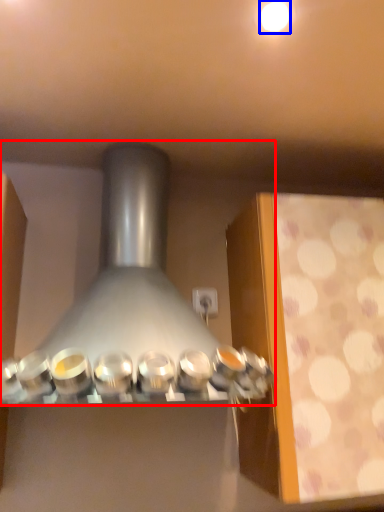
Question: Which object is further to the camera taking this photo, kitchen appliance (highlighted by a red box) or lighting (highlighted by a blue box)?

Choices:
 (A) kitchen appliance
 (B) lighting

Answer: (B)